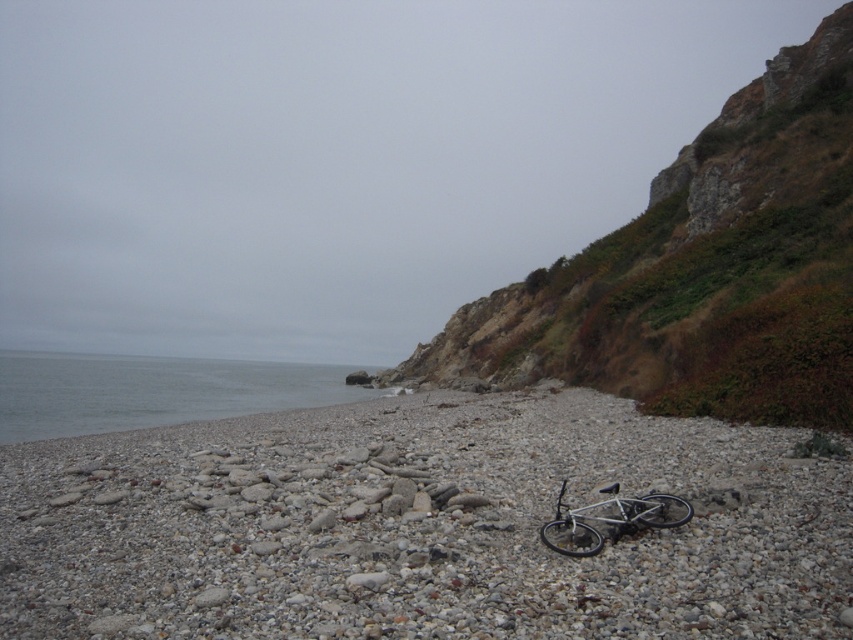
Question: Does rusty stone hillside at upper right appear on the left side of silver metallic bicycle at center?

Choices:
 (A) yes
 (B) no

Answer: (B)

Question: Does rusty stone hillside at upper right have a lesser width compared to gray smooth water at lower left?

Choices:
 (A) no
 (B) yes

Answer: (B)

Question: Which object is farther from the camera taking this photo?

Choices:
 (A) silver metallic bicycle at center
 (B) gray smooth water at lower left

Answer: (B)

Question: Based on their relative distances, which object is nearer to the rusty stone hillside at upper right?

Choices:
 (A) silver metallic bicycle at center
 (B) smooth gravel beach at center

Answer: (B)

Question: Is smooth gravel beach at center wider than gray smooth water at lower left?

Choices:
 (A) no
 (B) yes

Answer: (A)

Question: Which of the following is the closest to the observer?

Choices:
 (A) gray smooth water at lower left
 (B) rusty stone hillside at upper right
 (C) smooth gravel beach at center

Answer: (C)